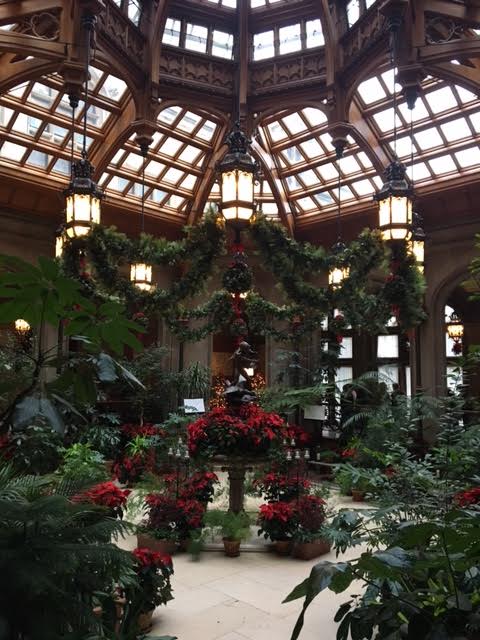
Where is `square planter box to right of center pedestal base`? This screenshot has height=640, width=480. square planter box to right of center pedestal base is located at coordinates (309, 548).